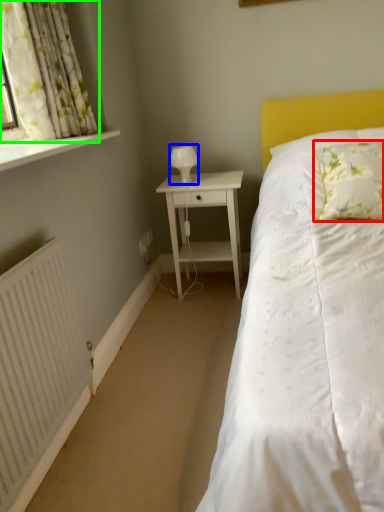
Question: Estimate the real-world distances between objects in this image. Which object is closer to pillow (highlighted by a red box), table lamp (highlighted by a blue box) or curtain (highlighted by a green box)?

Choices:
 (A) table lamp
 (B) curtain

Answer: (A)